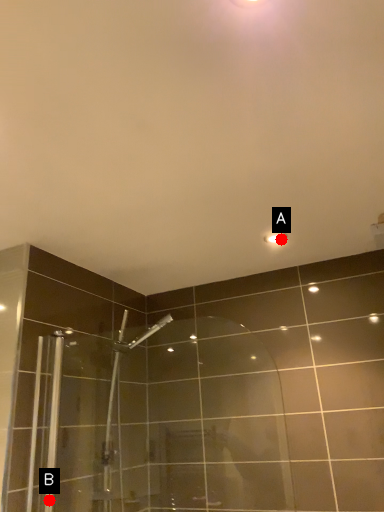
Question: Two points are circled on the image, labeled by A and B beside each circle. Among these points, which one is nearest to the camera?

Choices:
 (A) A is closer
 (B) B is closer

Answer: (B)